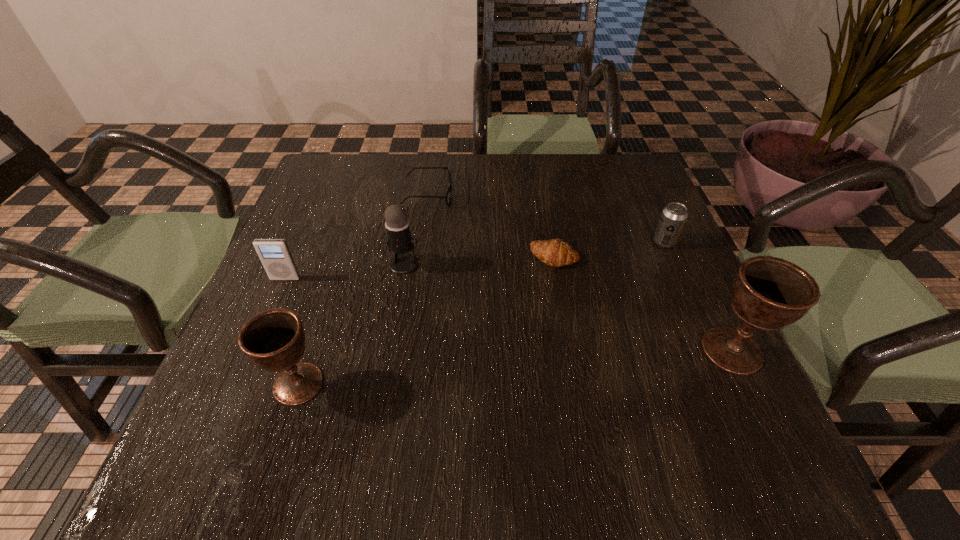
Find the location of a particular element. Image resolution: width=960 pixels, height=540 pixels. beer can positioned at the right edge is located at coordinates (673, 217).

Where is `object that is at the near left corner`? The height and width of the screenshot is (540, 960). object that is at the near left corner is located at coordinates (274, 340).

Locate an element on the screen. object at the near right corner is located at coordinates (768, 293).

Identify the location of vacant position at the far edge of the desktop. (498, 191).

Identify the location of vacant space at the near edge. The height and width of the screenshot is (540, 960). (329, 417).

You are a GUI agent. You are given a task and a screenshot of the screen. Output one action in this format:
    pyautogui.click(x=<x>, y=<y>)
    Task: Click on the vacant space at the left edge
    The image size is (960, 540).
    Given the screenshot: What is the action you would take?
    pyautogui.click(x=340, y=210)

The image size is (960, 540). Find the location of `free spot at the right edge of the desktop`. free spot at the right edge of the desktop is located at coordinates (650, 341).

What are the coordinates of `vacant space at the far left corner of the desktop` in the screenshot? It's located at (323, 158).

Find the location of a particular element. The height and width of the screenshot is (540, 960). free space at the near right corner of the desktop is located at coordinates (708, 402).

You are a GUI agent. You are given a task and a screenshot of the screen. Output one action in this format:
    pyautogui.click(x=<x>, y=<y>)
    Task: Click on the free point between the spectacles and the leftmost object
    The image size is (960, 540).
    Given the screenshot: What is the action you would take?
    pyautogui.click(x=357, y=237)